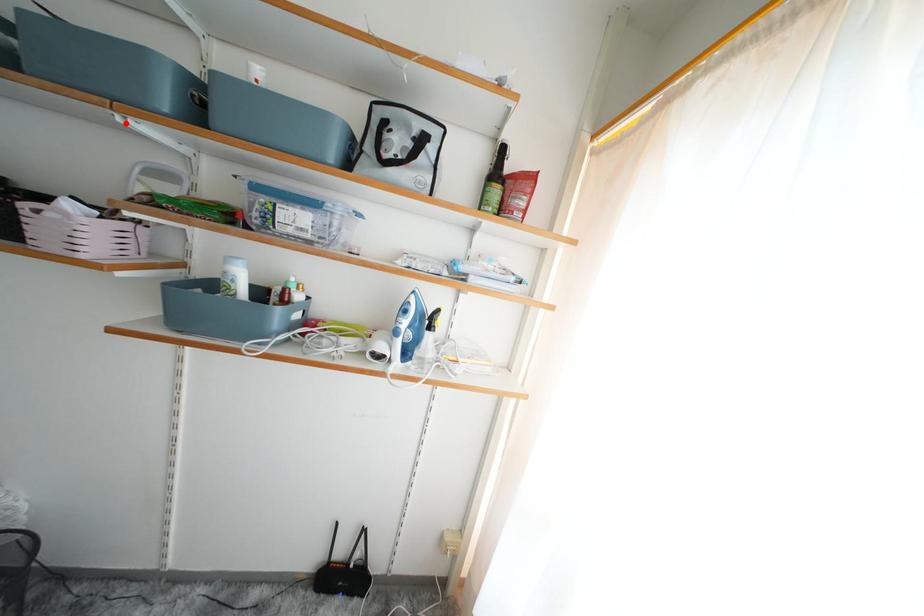
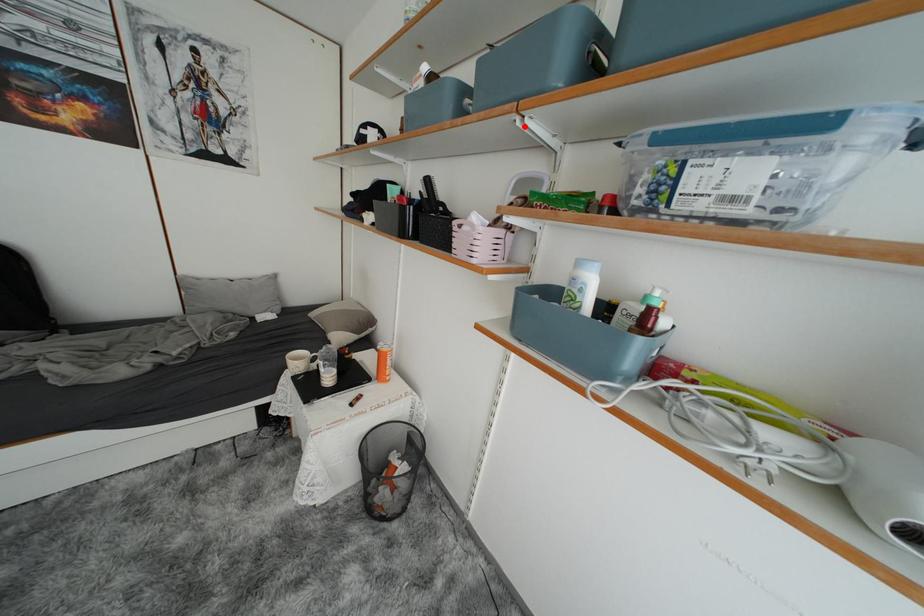
I am providing you with two images of the same scene from different viewpoints. A red point is marked on the first image and another point is marked on the second image. Is the marked point in image1 the same physical position as the marked point in image2?

Yes